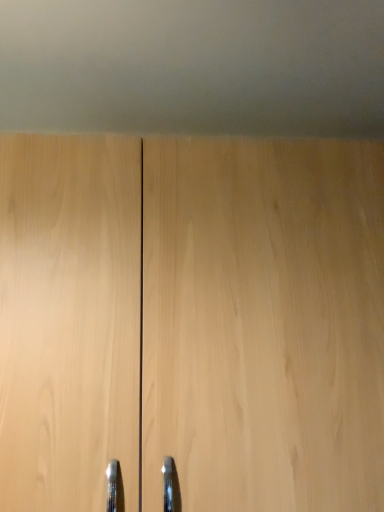
Question: Should I look upward or downward to see light wood door at center?

Choices:
 (A) down
 (B) up

Answer: (A)